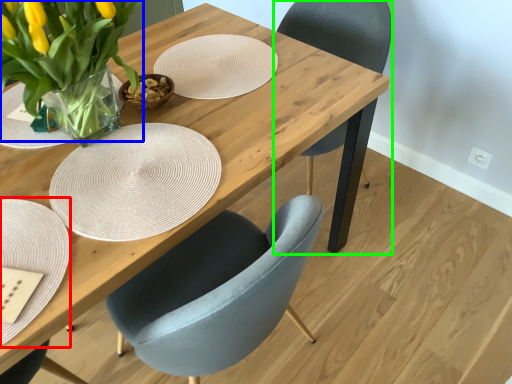
Question: Based on their relative distances, which object is nearer to plate (highlighted by a red box)? Choose from floral arrangement (highlighted by a blue box) and chair (highlighted by a green box).

Choices:
 (A) floral arrangement
 (B) chair

Answer: (A)